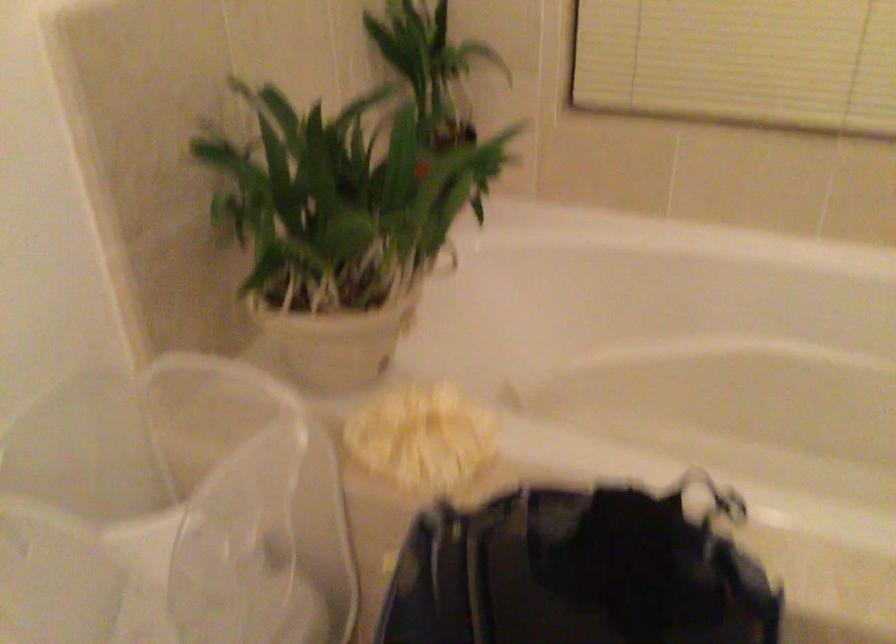
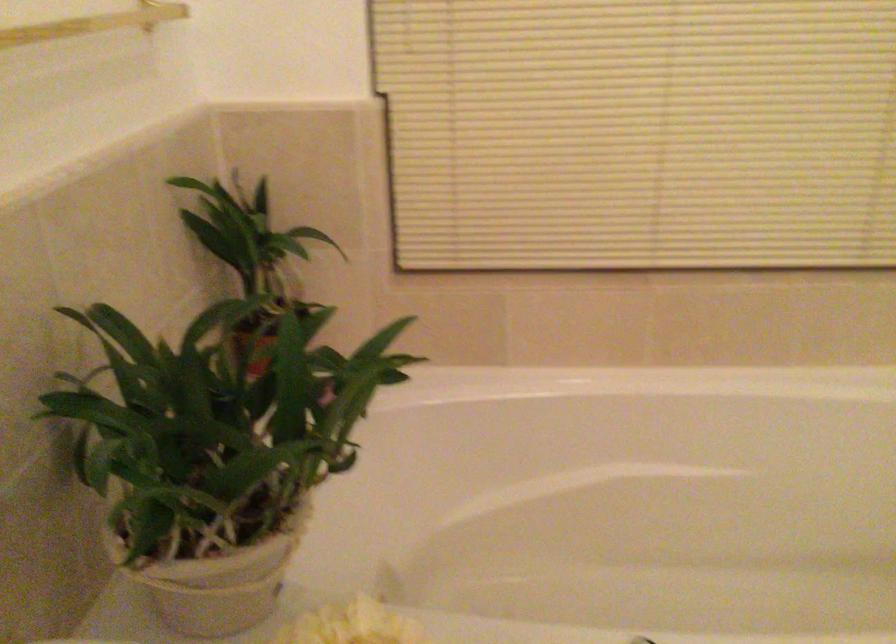
Question: The camera is either moving clockwise (left) or counter-clockwise (right) around the object. The first image is from the beginning of the video and the second image is from the end. Is the camera moving left or right when shooting the video?

Choices:
 (A) Left
 (B) Right

Answer: (A)